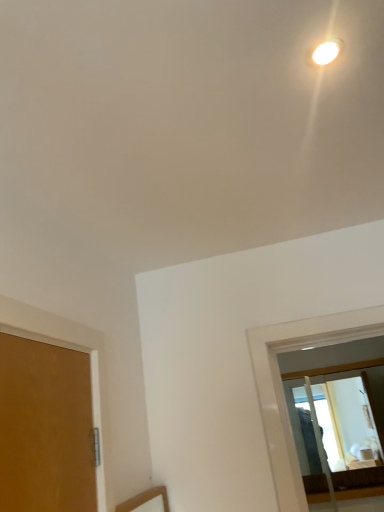
You are a GUI agent. You are given a task and a screenshot of the screen. Output one action in this format:
    pyautogui.click(x=<x>, y=<y>)
    Task: Click on the transparent glass window at lower right
    The image size is (384, 512).
    Given the screenshot: What is the action you would take?
    pyautogui.click(x=282, y=386)

What do you see at coordinates (282, 386) in the screenshot? I see `transparent glass window at lower right` at bounding box center [282, 386].

The width and height of the screenshot is (384, 512). Identify the location of transparent glass window at lower right. (282, 386).